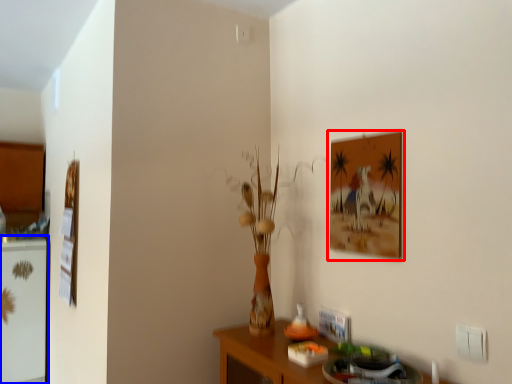
Question: Which point is closer to the camera, picture frame (highlighted by a red box) or fridge (highlighted by a blue box)?

Choices:
 (A) picture frame
 (B) fridge

Answer: (A)